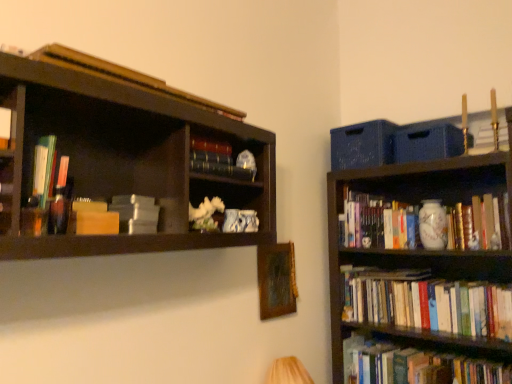
Question: From the image's perspective, is matte plastic books at left, which is the sixth book from right to left, on matte gray book at upper left, positioned as the fifth book in right-to-left order?

Choices:
 (A) no
 (B) yes

Answer: (B)

Question: Can you confirm if matte plastic books at left, which is the second book from left to right, is positioned to the left of matte gray book at upper left, positioned as the third book in left-to-right order?

Choices:
 (A) yes
 (B) no

Answer: (A)

Question: Is matte plastic books at left, the fourth book positioned from the top, with matte gray book at upper left, which ranks as the fifth book in top-to-bottom order?

Choices:
 (A) no
 (B) yes

Answer: (A)

Question: Is matte plastic books at left, placed as the 3th book when sorted from front to back, wider than matte gray book at upper left, acting as the fourth book starting from the front?

Choices:
 (A) yes
 (B) no

Answer: (B)

Question: Can you confirm if matte plastic books at left, placed as the 3th book when sorted from front to back, is thinner than matte gray book at upper left, acting as the fourth book starting from the front?

Choices:
 (A) yes
 (B) no

Answer: (A)

Question: Is matte plastic books at left, marked as the fourth book in a bottom-to-top arrangement, bigger than matte gray book at upper left, positioned as the fifth book in right-to-left order?

Choices:
 (A) no
 (B) yes

Answer: (A)

Question: Is matte gray book at upper left, which ranks as the fifth book in top-to-bottom order, aimed at wooden picture frame at center?

Choices:
 (A) no
 (B) yes

Answer: (A)

Question: Is wooden picture frame at center located within matte gray book at upper left, positioned as the third book in left-to-right order?

Choices:
 (A) yes
 (B) no

Answer: (B)

Question: Is matte gray book at upper left, positioned as the fifth book in right-to-left order, thinner than wooden picture frame at center?

Choices:
 (A) no
 (B) yes

Answer: (A)

Question: Is matte gray book at upper left, which appears as the third book when ordered from the bottom, oriented away from wooden picture frame at center?

Choices:
 (A) yes
 (B) no

Answer: (B)

Question: From a real-world perspective, is matte gray book at upper left, which appears as the third book when ordered from the bottom, physically below wooden picture frame at center?

Choices:
 (A) yes
 (B) no

Answer: (B)

Question: From the image's perspective, is matte gray book at upper left, positioned as the third book in left-to-right order, located above wooden picture frame at center?

Choices:
 (A) yes
 (B) no

Answer: (A)

Question: Does matte plastic books at left, marked as the fourth book in a bottom-to-top arrangement, have a smaller size compared to wooden picture frame at center?

Choices:
 (A) yes
 (B) no

Answer: (A)